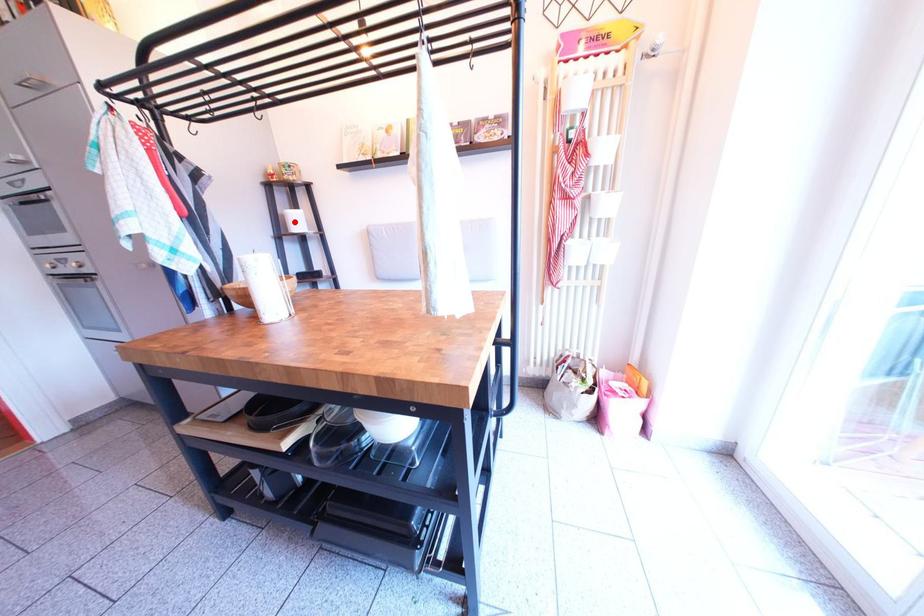
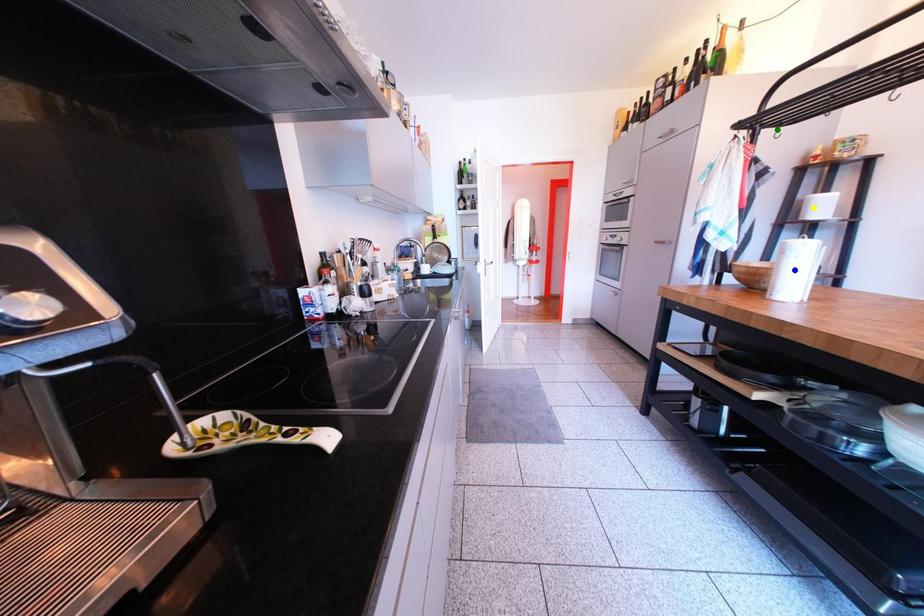
Question: I am providing you with two images of the same scene from different viewpoints. A red point is marked on the first image. You are given multiple points on the second image. Which mark in image 2 goes with the point in image 1?

Choices:
 (A) green point
 (B) blue point
 (C) yellow point

Answer: (C)